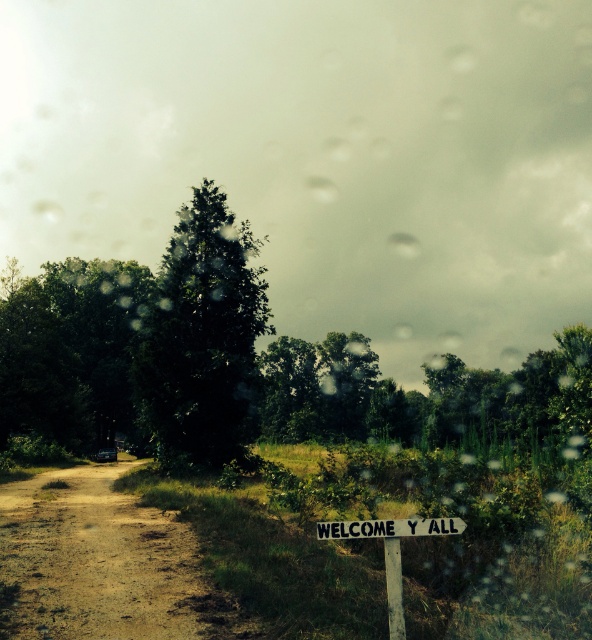
You are driving a car and notice a green leafy tree at center and a transparent glass car window at center. Which object appears wider from your current viewpoint inside the vehicle?

The green leafy tree at center appears wider than the transparent glass car window at center because its width is larger than the window.

In the scene shown: You are driving a car with a 15 feet long trailer attached. You want to turn around your car and trailer in the area shown in the image. Can you safely do so within the brown dirt track at lower left?

The brown dirt track at lower left is 22.22 feet away from camera. Since the total length of the car and trailer is 15 feet, there is sufficient space to turn around safely as 22.22 feet exceeds 15 feet.

You are driving along the brown dirt track at lower left and want to pass through a section where the green leafy tree at upper left is nearby. Considering their widths, which one is narrower?

Answer: The brown dirt track at lower left has a lesser width compared to the green leafy tree at upper left, so the brown dirt track at lower left is narrower.